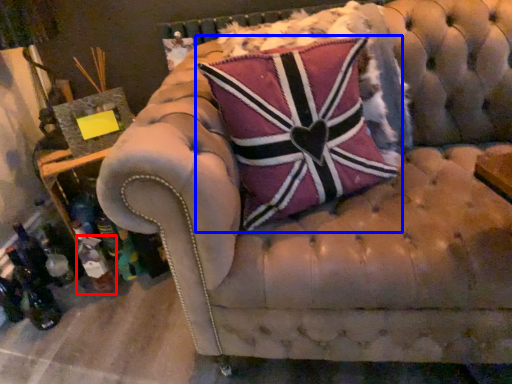
Question: Among these objects, which one is farthest to the camera, bottle (highlighted by a red box) or pillow (highlighted by a blue box)?

Choices:
 (A) bottle
 (B) pillow

Answer: (A)